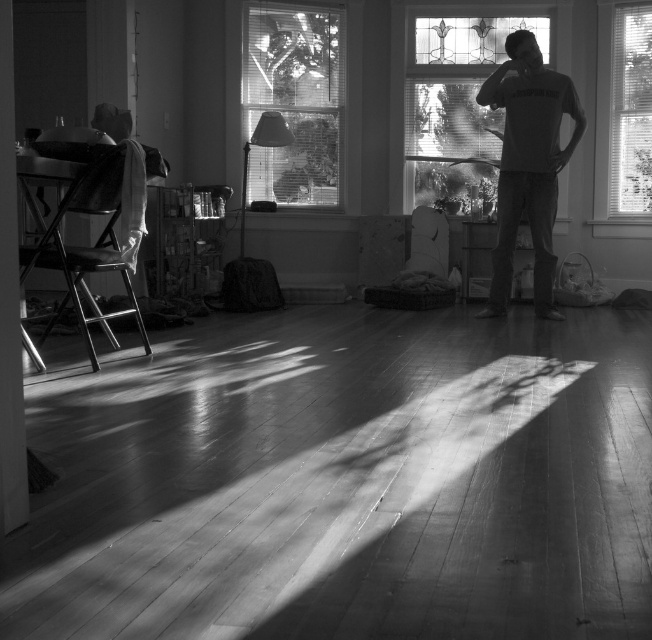
You are a photographer trying to capture a portrait of the person in the gray cotton shirt at center. The clear glass window at upper center is reflecting some light. How might the window affect the lighting on the subject?

The clear glass window at upper center is not as tall as gray cotton shirt at center, so the window is lower than the subject. This could cause harsh lighting from below, creating unflattering shadows on the subject.

You are a photographer trying to capture the best lighting for a photo shoot. You notice the clear glass window at upper center and the transparent glass window at right. Which window should you position your subject closer to if you want more natural light, and why?

The clear glass window at upper center is bigger than the transparent glass window at right, so positioning the subject closer to the clear glass window at upper center would provide more natural light because larger windows typically allow more light to enter.